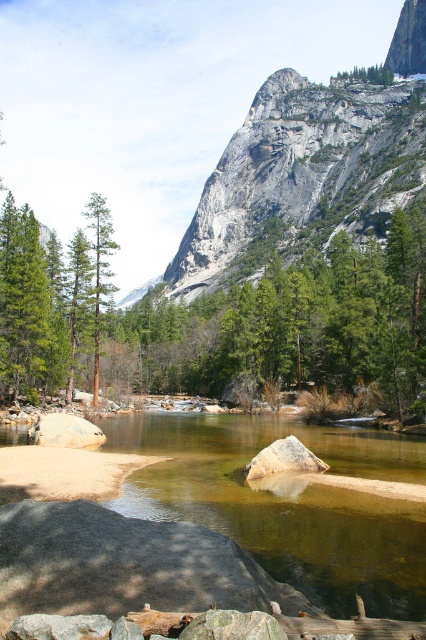
You are standing at the point marked as point (65, 432) in the lower left of the image. Looking around, you see a large mountain with light gray rock and green vegetation. What type of terrain are you currently standing on?

You are standing on smooth gray rock at lower left as indicated by the point (65, 432).